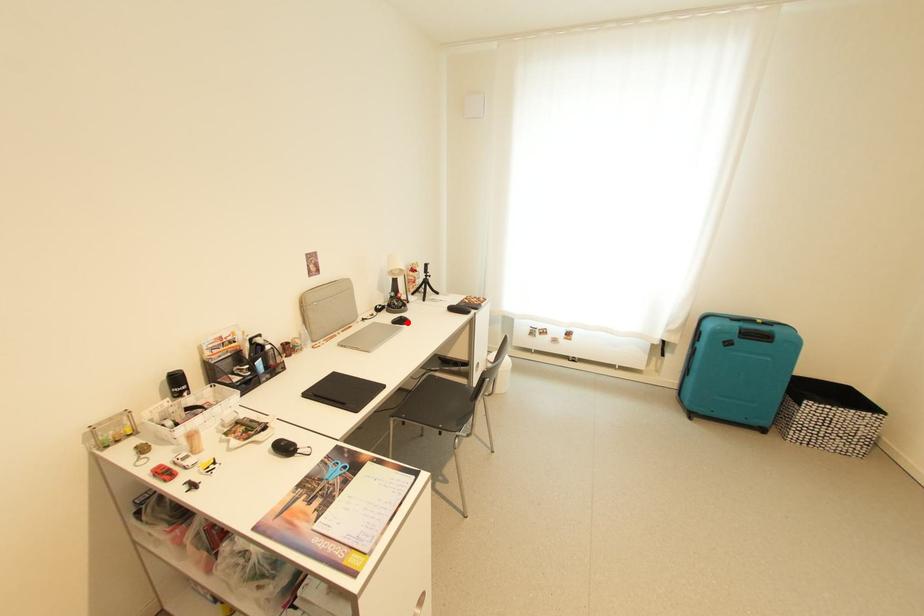
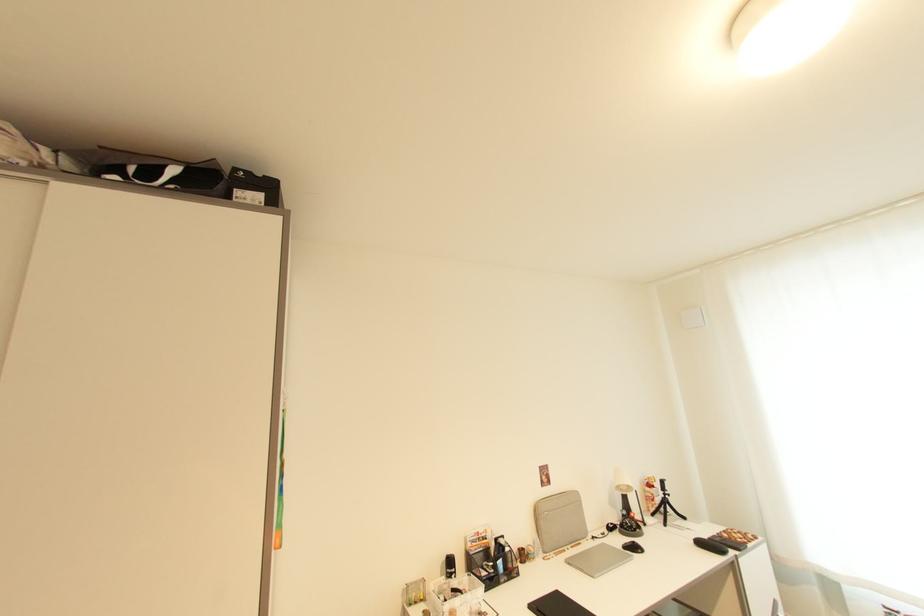
Where in the second image is the point corresponding to the highlighted location from the first image?

(639, 549)